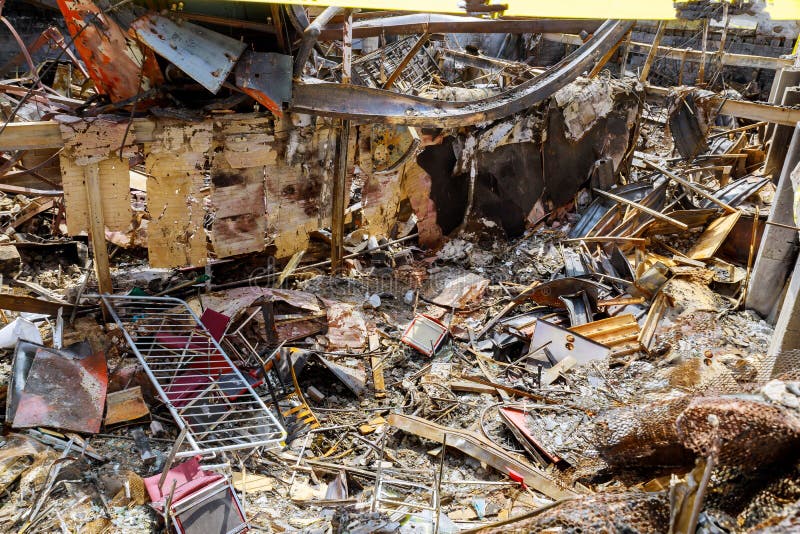
The height and width of the screenshot is (534, 800). Identify the location of beat up chair. (178, 480).